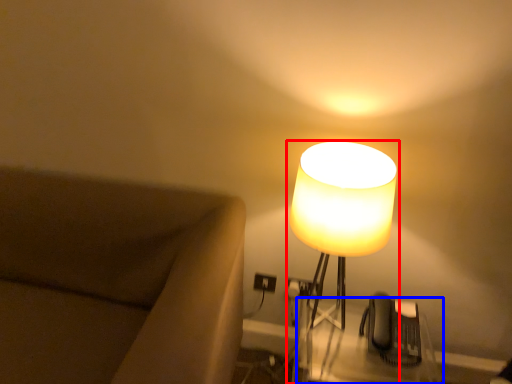
Question: Which point is closer to the camera, lamp (highlighted by a red box) or table (highlighted by a blue box)?

Choices:
 (A) lamp
 (B) table

Answer: (A)